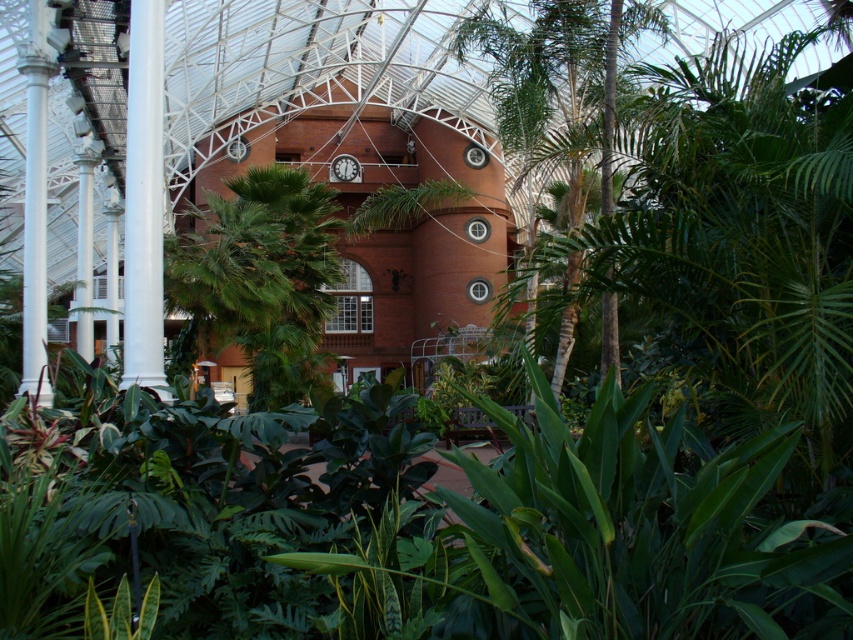
Does point (206, 204) lie behind point (598, 64)?

Yes, it is.

Can you confirm if green leafy palm at center is positioned above green leafy tree at center?

Yes, green leafy palm at center is above green leafy tree at center.

Does point (282, 259) come behind point (567, 300)?

Yes, point (282, 259) is farther from viewer.

The height and width of the screenshot is (640, 853). Find the location of `green leafy palm at center`. green leafy palm at center is located at coordinates (257, 280).